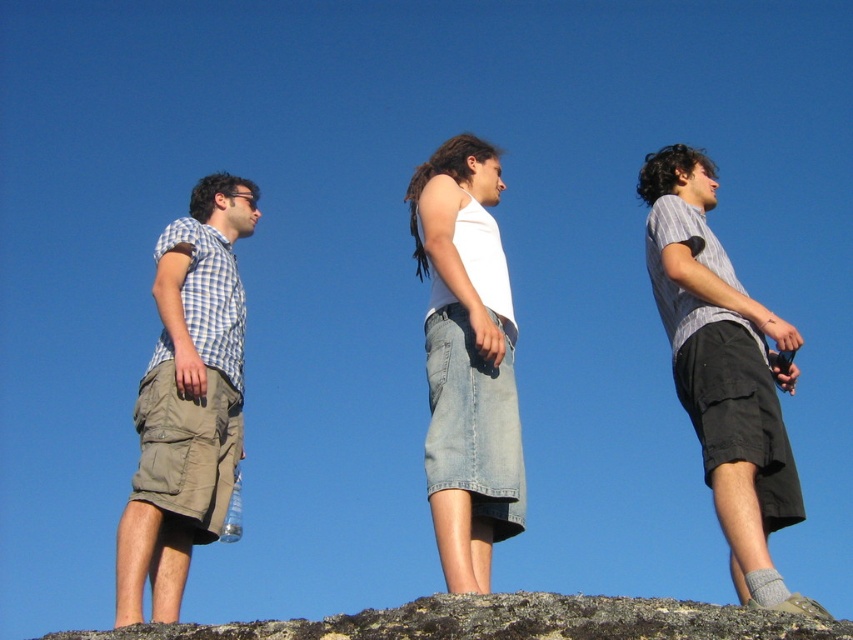
Question: Which point appears closest to the camera in this image?

Choices:
 (A) (672, 186)
 (B) (312, 634)
 (C) (450, 195)
 (D) (154, 552)

Answer: (B)

Question: Does white cotton tank top at center appear on the right side of brown rock at lower center?

Choices:
 (A) yes
 (B) no

Answer: (B)

Question: Does striped cotton shirt at right have a lesser width compared to brown rock at lower center?

Choices:
 (A) yes
 (B) no

Answer: (A)

Question: Which object is the closest to the light brown cargo shorts at left?

Choices:
 (A) white cotton tank top at center
 (B) striped cotton shirt at right

Answer: (A)

Question: Does white cotton tank top at center have a lesser width compared to brown rock at lower center?

Choices:
 (A) yes
 (B) no

Answer: (A)

Question: Estimate the real-world distances between objects in this image. Which object is closer to the striped cotton shirt at right?

Choices:
 (A) light brown cargo shorts at left
 (B) brown rock at lower center
 (C) white cotton tank top at center

Answer: (C)